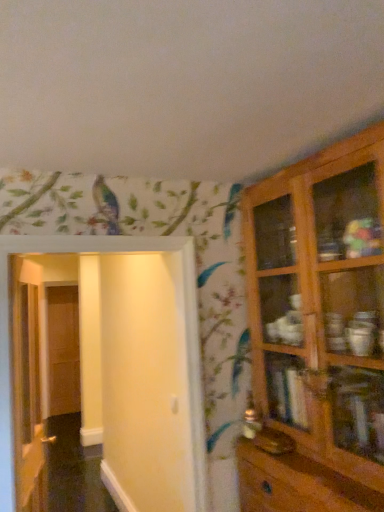
Question: Is white glossy door at left, positioned as the 2th door in left-to-right order, facing away from wooden cabinet at right?

Choices:
 (A) no
 (B) yes

Answer: (A)

Question: Is white glossy door at left, which is counted as the second door, starting from the right, wider than wooden cabinet at right?

Choices:
 (A) yes
 (B) no

Answer: (B)

Question: Can you confirm if white glossy door at left, positioned as the 2th door in left-to-right order, is thinner than wooden cabinet at right?

Choices:
 (A) no
 (B) yes

Answer: (B)

Question: Is white glossy door at left, positioned as the 2th door in left-to-right order, with wooden cabinet at right?

Choices:
 (A) yes
 (B) no

Answer: (B)

Question: From the image's perspective, is white glossy door at left, which is the 2th door in front-to-back order, located beneath wooden cabinet at right?

Choices:
 (A) no
 (B) yes

Answer: (B)

Question: Are white glossy door at left, which is counted as the second door, starting from the right, and wooden cabinet at right located far from each other?

Choices:
 (A) yes
 (B) no

Answer: (A)

Question: Could you tell me if wooden cabinet at right is facing wooden door at left, the first door from the left?

Choices:
 (A) yes
 (B) no

Answer: (B)

Question: From the image's perspective, does wooden cabinet at right appear lower than wooden door at left, the 3th door positioned from the right?

Choices:
 (A) no
 (B) yes

Answer: (A)

Question: Can you confirm if wooden cabinet at right is wider than wooden door at left, the first door from the left?

Choices:
 (A) yes
 (B) no

Answer: (A)

Question: Is wooden cabinet at right smaller than wooden door at left, placed as the 1th door when sorted from back to front?

Choices:
 (A) no
 (B) yes

Answer: (A)

Question: From a real-world perspective, does wooden cabinet at right stand above wooden door at left, arranged as the 3th door when viewed from the front?

Choices:
 (A) yes
 (B) no

Answer: (A)

Question: Does wooden cabinet at right come in front of wooden door at left, the 3th door positioned from the right?

Choices:
 (A) no
 (B) yes

Answer: (B)

Question: Is wooden door at left, the 3th door positioned from the right, wider than wooden cabinet at right?

Choices:
 (A) yes
 (B) no

Answer: (B)